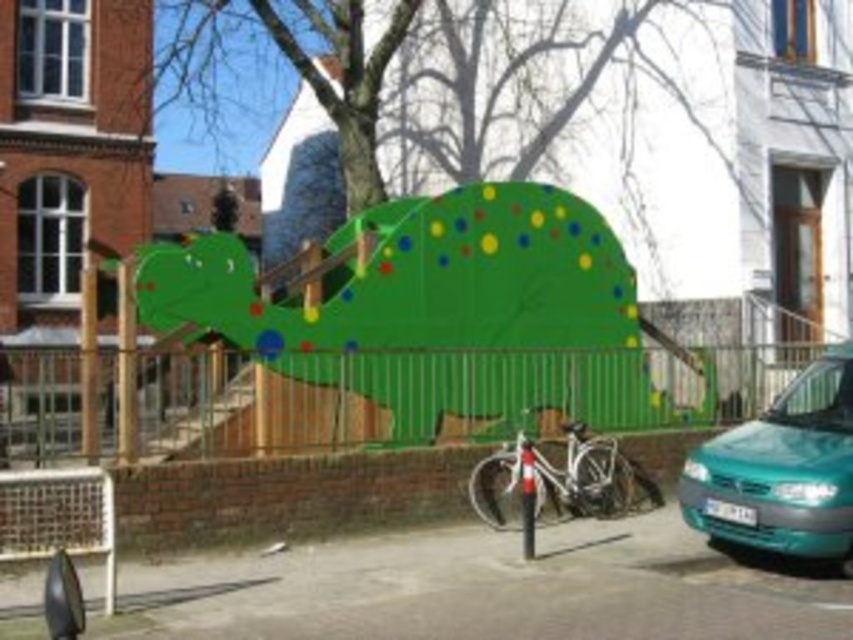
You are a delivery driver who needs to park your teal glossy van at lower right near the green matte climbing wall at center. Based on the scene, can you park the van directly in front of the climbing wall without blocking the paved area where the bicycle is parked?

The teal glossy van at lower right is behind the green matte climbing wall at center, so parking it directly in front of the climbing wall would require moving it from its current position behind the wall to the front. However, the paved area where the bicycle is parked is already occupied, so the van cannot be parked there without blocking the bicycle.

You are planning to take a photo of the green matte climbing wall at center and the teal glossy van at lower right together in the frame. Considering their sizes, which object should you position closer to the camera to ensure both fit in the photo?

Since the green matte climbing wall at center is thinner than the teal glossy van at lower right, you should position the teal glossy van at lower right closer to the camera to balance their sizes in the photo.